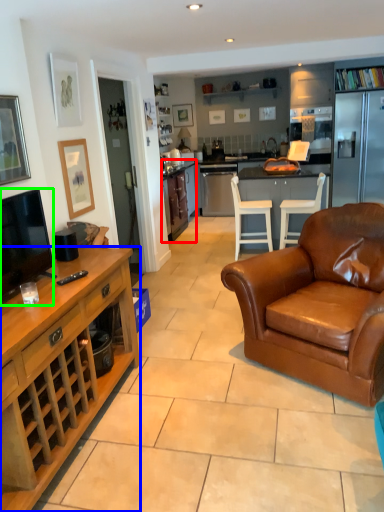
Question: Based on their relative distances, which object is nearer to cabinetry (highlighted by a red box)? Choose from cabinetry (highlighted by a blue box) and television (highlighted by a green box).

Choices:
 (A) cabinetry
 (B) television

Answer: (A)